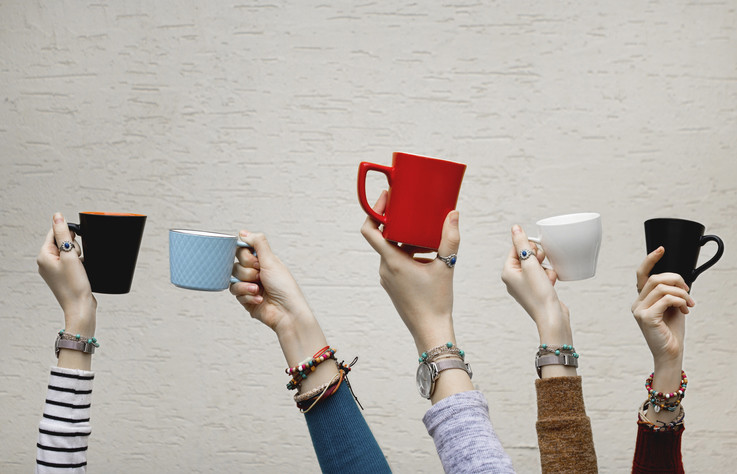
Identify the location of mugs. (104, 248), (178, 268), (422, 189), (567, 226), (685, 240).